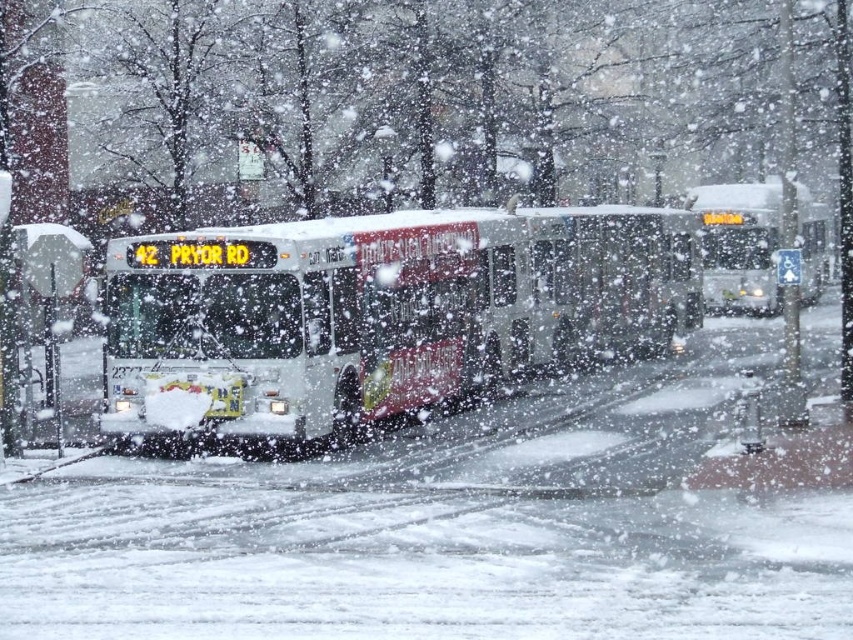
Based on the photo, you are a drone operator flying a drone above a snowy street. You notice two points marked on your screen at coordinates point (407, 392) and point (42, 298). Which point is closer to your drone?

Point (42, 298) is closer to the drone because it is nearer to the camera than point (407, 392).

You are a delivery person needing to park your 2.5 meter wide van between the white glossy bus at center and the metallic silver bus stop at left. Can you fit your van there?

The white glossy bus at center is wider than the metallic silver bus stop at left. Since the van is 2.5 meters wide, it depends on the available space between them. However, without knowing the exact distance between the two objects, it is impossible to determine if the van can fit.

You are a delivery driver who needs to park your truck, which is 25 feet long, between the white metallic bus at center and the white glossy bus at center. According to the scene description, can your truck fit in the space between them?

The white metallic bus at center is 27.48 feet from white glossy bus at center. Since your truck is 25 feet long, it can fit in the space between them as the distance is greater than the truck length.